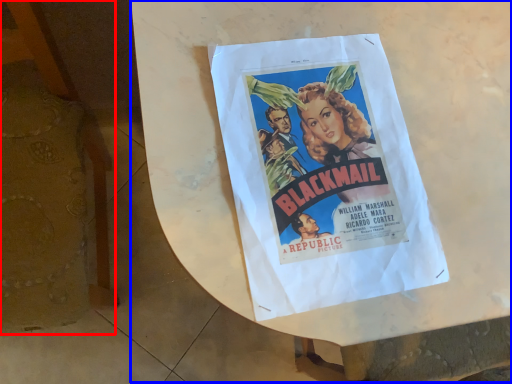
Question: Which object appears closest to the camera in this image, furniture (highlighted by a red box) or round table (highlighted by a blue box)?

Choices:
 (A) furniture
 (B) round table

Answer: (A)